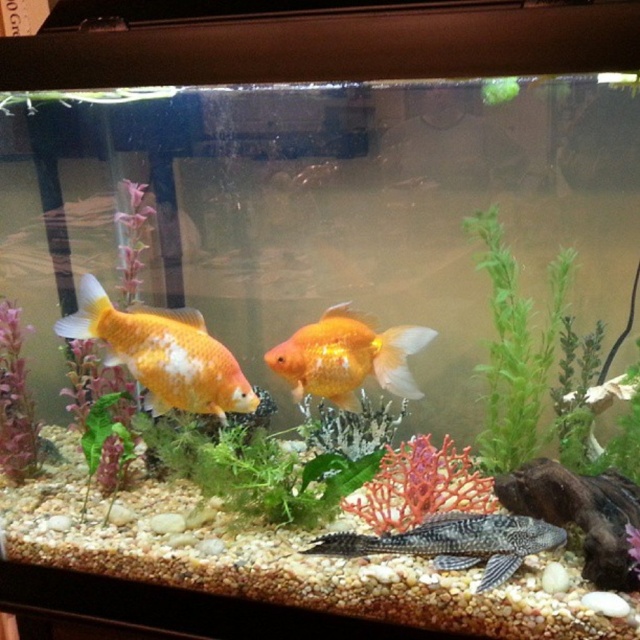
You are a new goldfish in the aquarium and want to swim to the shiny orange goldfish at center. Based on the coordinates provided, which direction should you swim from your current position at point 0.3, 0.3?

The shiny orange goldfish at center is located at point (163, 353). Since your current position is (192, 192), you should swim towards the right and slightly downward to reach it.

You are an aquatic plant seller who wants to arrange the matte purple plant at left and the green leafy plant at center in a display. Which plant should you place in the back of the display to create a visually balanced arrangement?

The matte purple plant at left should be placed at the back of the display because it is larger in size than the green leafy plant at center, allowing for a balanced arrangement.

You are a new fish in the aquarium and want to find a hiding spot near the bottom. The black matte fish at bottom is located at point (456, 541). Which direction should you swim to reach the nearest hiding spot?

The black matte fish at bottom is located at point (456, 541), so you should swim towards the bottom to reach the nearest hiding spot.